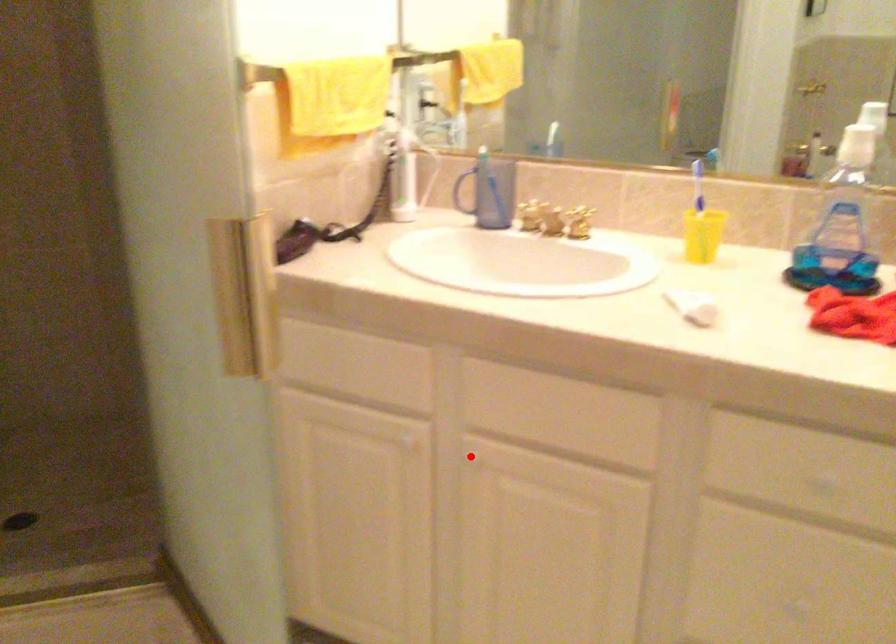
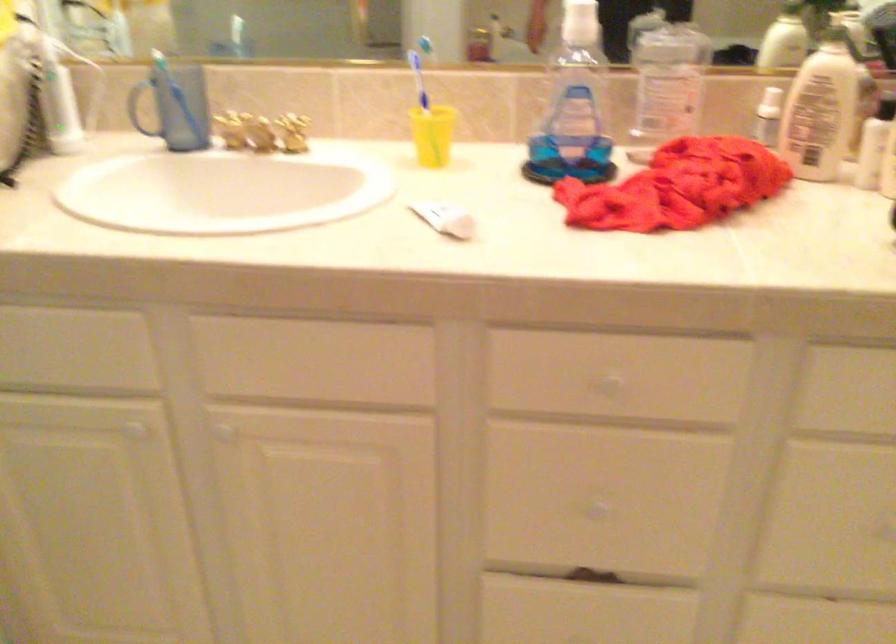
Question: I am providing you with two images of the same scene from different viewpoints. A red point is shown in image1. For the corresponding object point in image2, is it positioned nearer or farther from the camera?

Choices:
 (A) Nearer
 (B) Farther

Answer: (A)